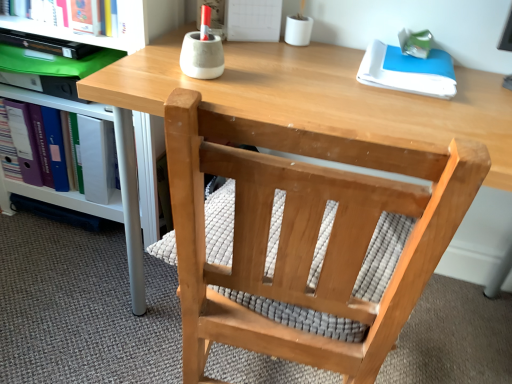
Question: Is natural wood chair at center smaller than purple ring-binder at left?

Choices:
 (A) no
 (B) yes

Answer: (A)

Question: Is the depth of natural wood chair at center less than that of purple ring-binder at left?

Choices:
 (A) yes
 (B) no

Answer: (A)

Question: Is natural wood chair at center positioned far away from purple ring-binder at left?

Choices:
 (A) no
 (B) yes

Answer: (A)

Question: Is natural wood chair at center bigger than purple ring-binder at left?

Choices:
 (A) yes
 (B) no

Answer: (A)

Question: From the image's perspective, does natural wood chair at center appear lower than purple ring-binder at left?

Choices:
 (A) yes
 (B) no

Answer: (A)

Question: Is natural wood chair at center in front of or behind purple ring-binder at left in the image?

Choices:
 (A) behind
 (B) front

Answer: (B)

Question: Would you say natural wood chair at center is to the left or to the right of purple ring-binder at left in the picture?

Choices:
 (A) right
 (B) left

Answer: (A)

Question: Is point (264, 258) positioned closer to the camera than point (110, 152)?

Choices:
 (A) farther
 (B) closer

Answer: (B)

Question: Looking at the image, does natural wood chair at center seem bigger or smaller compared to purple ring-binder at left?

Choices:
 (A) big
 (B) small

Answer: (A)

Question: Is white glossy shelf at lower left bigger or smaller than white paper at upper right?

Choices:
 (A) big
 (B) small

Answer: (A)

Question: From the image's perspective, is white glossy shelf at lower left located above or below white paper at upper right?

Choices:
 (A) below
 (B) above

Answer: (A)

Question: Considering the positions of point (170, 13) and point (400, 87), is point (170, 13) closer or farther from the camera than point (400, 87)?

Choices:
 (A) farther
 (B) closer

Answer: (A)

Question: Considering the positions of white glossy shelf at lower left and white paper at upper right in the image, is white glossy shelf at lower left wider or thinner than white paper at upper right?

Choices:
 (A) thin
 (B) wide

Answer: (B)

Question: Based on their positions, is purple ring-binder at left located to the left or right of white paper at upper right?

Choices:
 (A) left
 (B) right

Answer: (A)

Question: Is point (24, 96) positioned closer to the camera than point (419, 87)?

Choices:
 (A) closer
 (B) farther

Answer: (B)